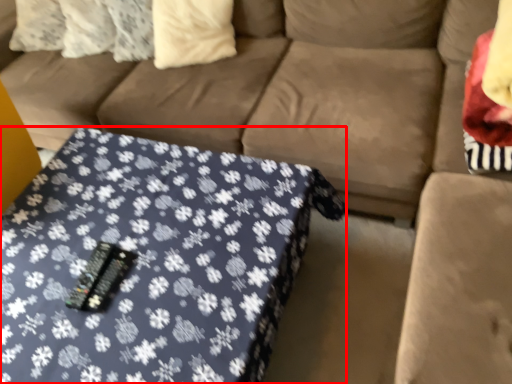
Question: From the image, what is the correct spatial relationship of table (annotated by the red box) in relation to pillow?

Choices:
 (A) right
 (B) left

Answer: (B)